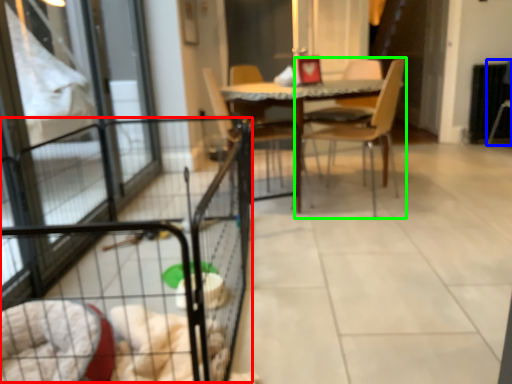
Question: Which is nearer to the cage (highlighted by a red box)? armchair (highlighted by a blue box) or chair (highlighted by a green box).

Choices:
 (A) armchair
 (B) chair

Answer: (B)